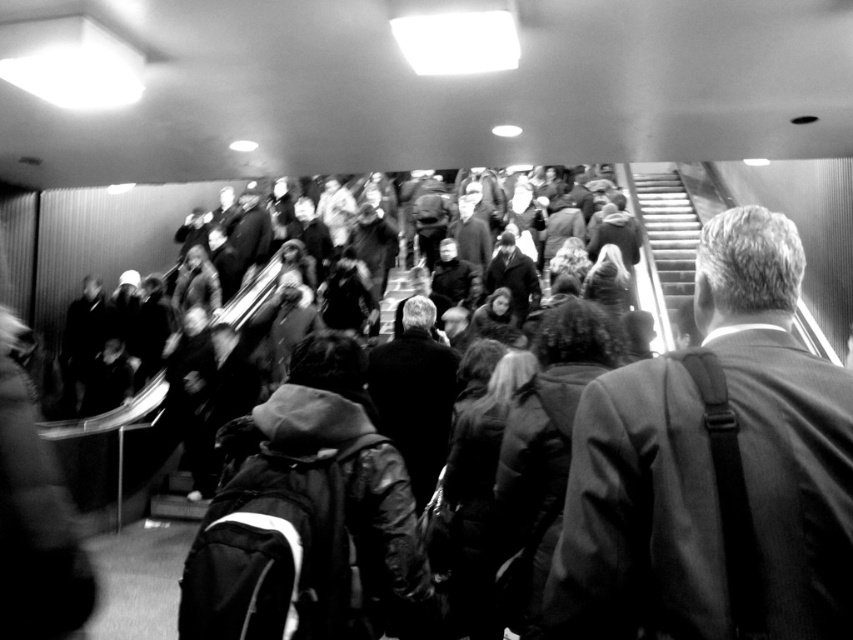
Is dark gray hooded jacket at center shorter than metallic silver escalator at upper right?

No.

Is point (312, 392) farther from viewer compared to point (689, 324)?

No, it is in front of (689, 324).

Who is more forward, [399,540] or [659,250]?

Point [399,540]

The image size is (853, 640). In order to click on dark gray hooded jacket at center in this screenshot , I will do `click(310, 518)`.

Does suit at center have a smaller size compared to dark gray hooded jacket at center?

Yes, suit at center is smaller than dark gray hooded jacket at center.

At what (x,y) coordinates should I click in order to perform the action: click on suit at center. Please return your answer as a coordinate pair (x, y). Looking at the image, I should click on (712, 468).

You are a GUI agent. You are given a task and a screenshot of the screen. Output one action in this format:
    pyautogui.click(x=<x>, y=<y>)
    Task: Click on the suit at center
    The image size is (853, 640).
    Given the screenshot: What is the action you would take?
    pyautogui.click(x=712, y=468)

Does suit at center lie in front of metallic silver escalator at upper right?

Yes, suit at center is closer to the viewer.

Between point (570, 472) and point (680, 305), which one is positioned in front?

Point (570, 472) is in front.

Which is behind, point (782, 227) or point (660, 316)?

The point (660, 316) is more distant.

Locate an element on the screen. This screenshot has height=640, width=853. suit at center is located at coordinates (712, 468).